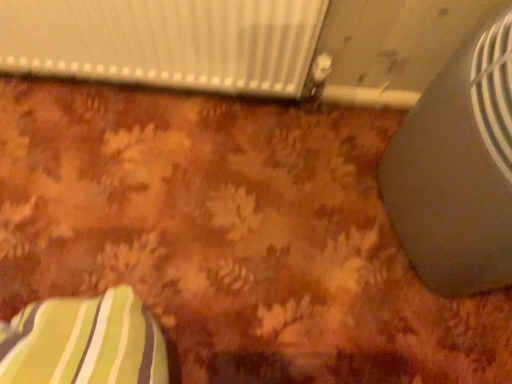
Question: Is satin gray fan at right taller or shorter than white textured radiator at upper center?

Choices:
 (A) tall
 (B) short

Answer: (A)

Question: Is satin gray fan at right in front of or behind white textured radiator at upper center in the image?

Choices:
 (A) behind
 (B) front

Answer: (B)

Question: Is satin gray fan at right inside or outside of white textured radiator at upper center?

Choices:
 (A) outside
 (B) inside

Answer: (A)

Question: Based on their sizes in the image, would you say white textured radiator at upper center is bigger or smaller than satin gray fan at right?

Choices:
 (A) small
 (B) big

Answer: (A)

Question: Is point (76, 66) positioned closer to the camera than point (497, 19)?

Choices:
 (A) closer
 (B) farther

Answer: (B)

Question: Choose the correct answer: Is white textured radiator at upper center inside satin gray fan at right or outside it?

Choices:
 (A) outside
 (B) inside

Answer: (A)

Question: From a real-world perspective, is white textured radiator at upper center physically located above or below satin gray fan at right?

Choices:
 (A) below
 (B) above

Answer: (A)